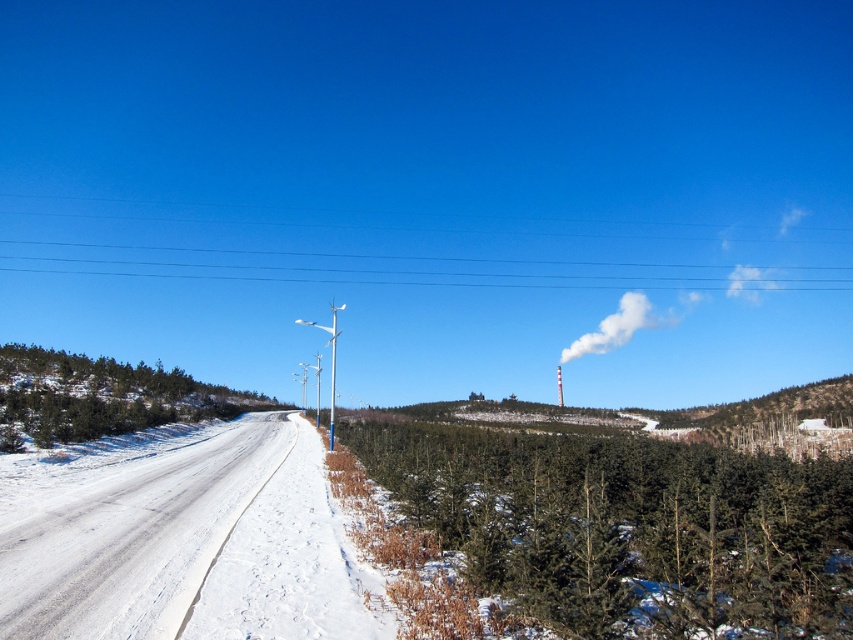
You are a painter standing at the edge of the snow road. You want to paint the green matte tree at lower right and the clear blue wires at upper center. Which object will require more paint to cover its width?

The clear blue wires at upper center are thicker than the green matte tree at lower right, so you will need more paint to cover their width.